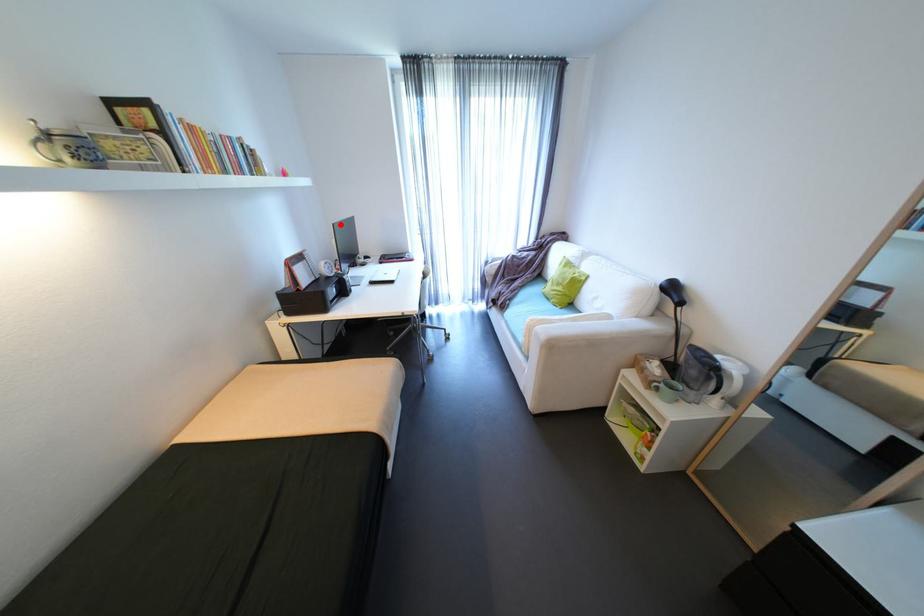
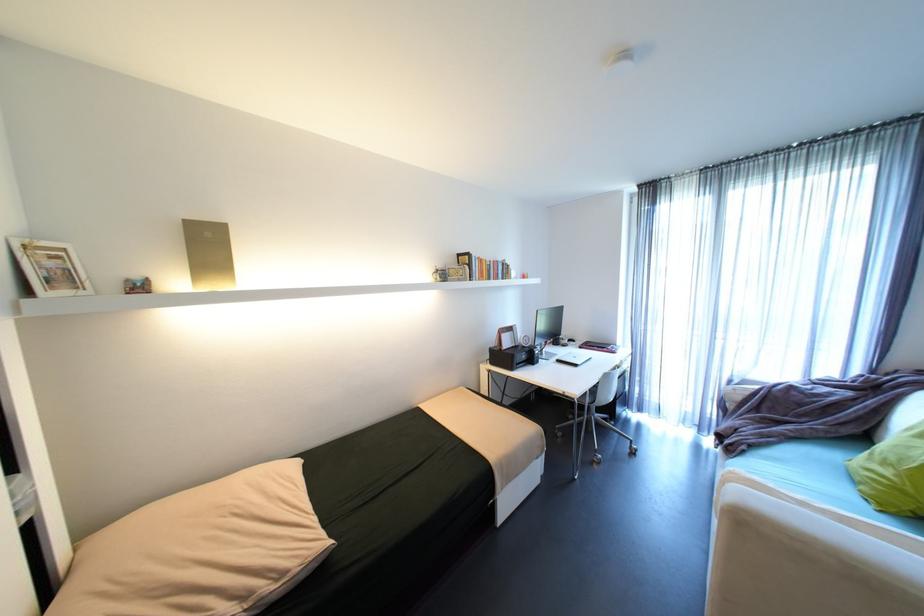
Where in the second image is the point corresponding to the highlighted location from the first image?

(544, 310)